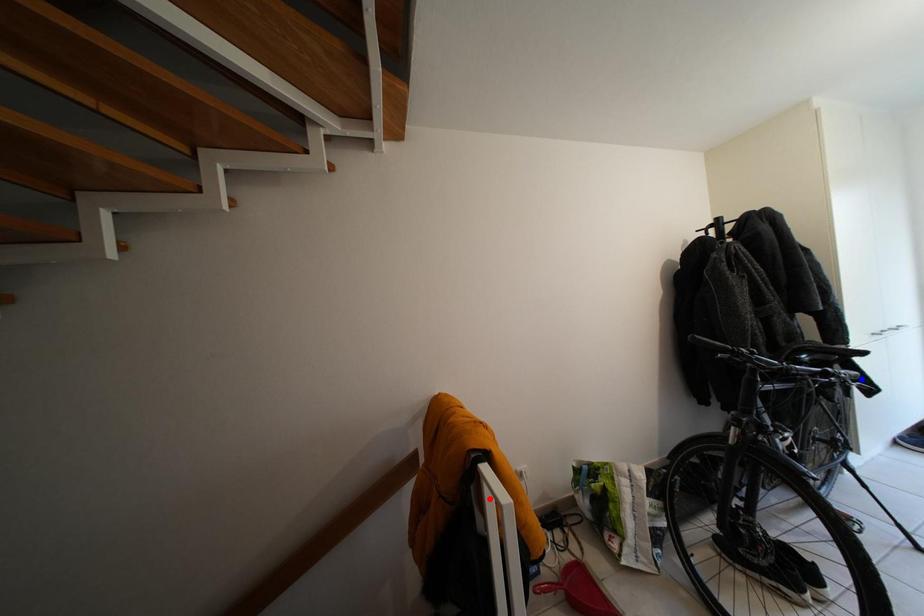
Question: Which of the two points in the image is closer to the camera?

Choices:
 (A) Blue point is closer.
 (B) Red point is closer.

Answer: (B)